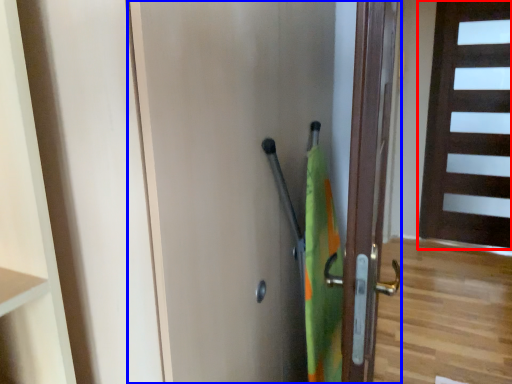
Question: Which object appears farthest to the camera in this image, door (highlighted by a red box) or door (highlighted by a blue box)?

Choices:
 (A) door
 (B) door

Answer: (A)